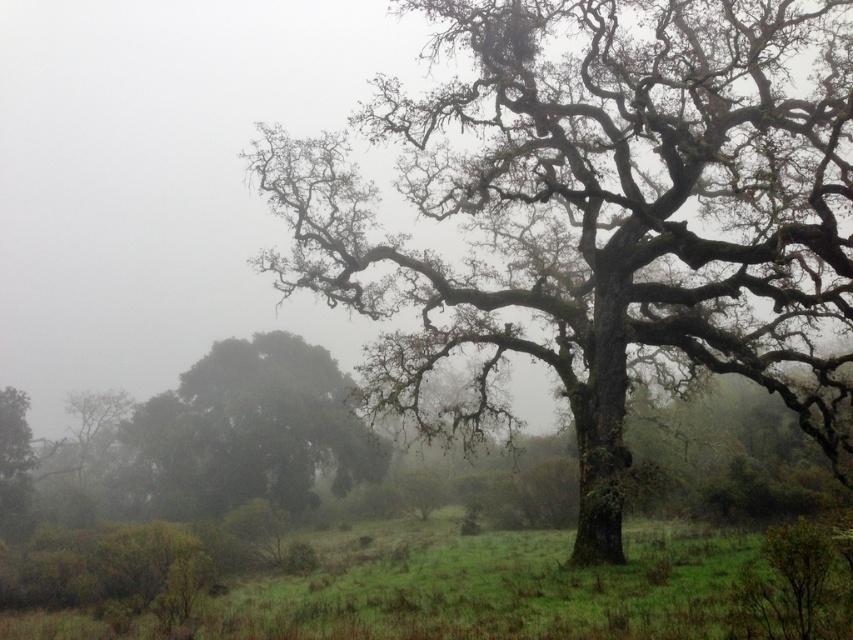
Question: Is green mossy tree at center wider than green leafy tree at left?

Choices:
 (A) no
 (B) yes

Answer: (B)

Question: Is green mossy tree at center further to camera compared to green leafy tree at left?

Choices:
 (A) yes
 (B) no

Answer: (B)

Question: Among these points, which one is farthest from the camera?

Choices:
 (A) (634, 321)
 (B) (289, 486)

Answer: (B)

Question: In this image, where is green mossy tree at center located relative to green leafy tree at left?

Choices:
 (A) below
 (B) above

Answer: (B)

Question: Which of the following is the farthest from the observer?

Choices:
 (A) (294, 372)
 (B) (590, 74)

Answer: (A)